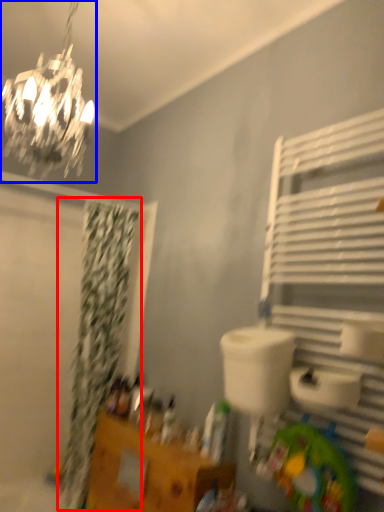
Question: Which point is closer to the camera, shower curtain (highlighted by a red box) or lamp (highlighted by a blue box)?

Choices:
 (A) shower curtain
 (B) lamp

Answer: (B)